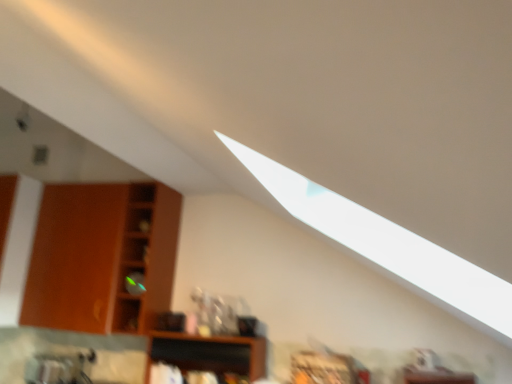
Question: Visually, is wooden cabinet at left, placed as the 1th shelf when sorted from top to bottom, positioned to the left or to the right of wooden at center, marked as the 1th shelf in a bottom-to-top arrangement?

Choices:
 (A) right
 (B) left

Answer: (B)

Question: Which is correct: wooden cabinet at left, which ranks as the second shelf in right-to-left order, is inside wooden at center, marked as the 1th shelf in a bottom-to-top arrangement, or outside of it?

Choices:
 (A) outside
 (B) inside

Answer: (A)

Question: Considering the positions of wooden cabinet at left, which ranks as the second shelf in right-to-left order, and wooden at center, the second shelf positioned from the top, in the image, is wooden cabinet at left, which ranks as the second shelf in right-to-left order, bigger or smaller than wooden at center, the second shelf positioned from the top,?

Choices:
 (A) small
 (B) big

Answer: (B)

Question: Considering their positions, is wooden at center, the second shelf positioned from the top, located in front of or behind wooden cabinet at left, which ranks as the second shelf in right-to-left order?

Choices:
 (A) front
 (B) behind

Answer: (A)

Question: Would you say wooden at center, the 1th shelf when ordered from right to left, is to the left or to the right of wooden cabinet at left, placed as the 1th shelf when sorted from top to bottom, in the picture?

Choices:
 (A) right
 (B) left

Answer: (A)

Question: From a real-world perspective, relative to wooden cabinet at left, which appears as the first shelf when viewed from the left, is wooden at center, the 1th shelf when ordered from right to left, vertically above or below?

Choices:
 (A) below
 (B) above

Answer: (A)

Question: From the image's perspective, is wooden at center, the 1th shelf when ordered from right to left, positioned above or below wooden cabinet at left, which appears as the first shelf when viewed from the left?

Choices:
 (A) above
 (B) below

Answer: (B)